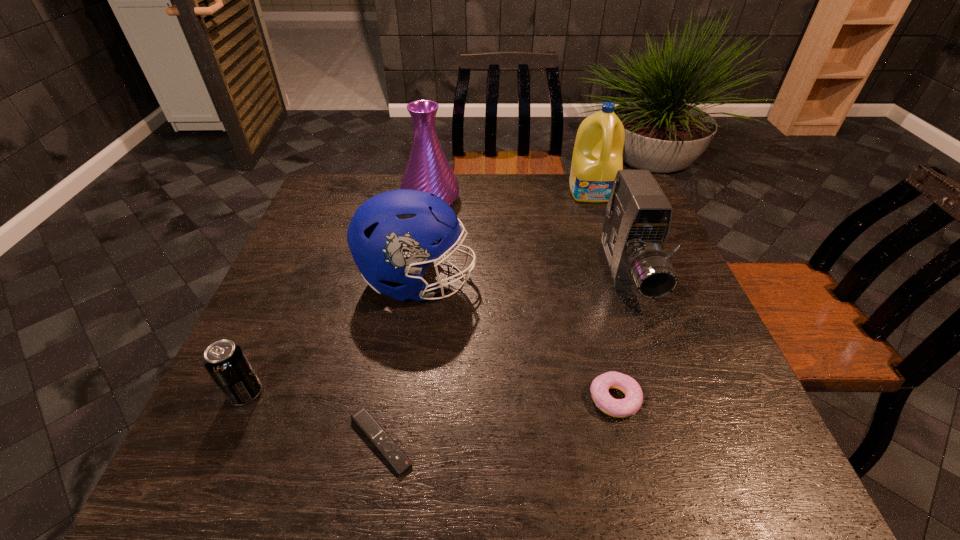
This screenshot has height=540, width=960. I want to click on vacant space located on the face guard of the football helmet, so click(x=585, y=281).

Where is `vacant space located 0.140m at the front of the camcorder, highlighting the lens`? vacant space located 0.140m at the front of the camcorder, highlighting the lens is located at coordinates (660, 367).

The image size is (960, 540). In order to click on free location located on the left of the doughnut in this screenshot , I will do `click(512, 399)`.

Find the location of a particular element. Image resolution: width=960 pixels, height=540 pixels. free space located on the back of the shortest object is located at coordinates (408, 283).

Find the location of a particular element. This screenshot has width=960, height=540. vase that is at the far edge is located at coordinates (428, 170).

Find the location of a particular element. detergent located in the far edge section of the desktop is located at coordinates (597, 156).

Where is `object that is at the near edge`? Image resolution: width=960 pixels, height=540 pixels. object that is at the near edge is located at coordinates (393, 454).

You are a GUI agent. You are given a task and a screenshot of the screen. Output one action in this format:
    pyautogui.click(x=<x>, y=<y>)
    Task: Click on the object positioned at the left edge
    
    Given the screenshot: What is the action you would take?
    pyautogui.click(x=225, y=361)

You are a GUI agent. You are given a task and a screenshot of the screen. Output one action in this format:
    pyautogui.click(x=<x>, y=<y>)
    Task: Click on the detergent that is at the right edge
    
    Given the screenshot: What is the action you would take?
    pyautogui.click(x=597, y=156)

This screenshot has width=960, height=540. What are the coordinates of `camcorder that is at the right edge` in the screenshot? It's located at (637, 222).